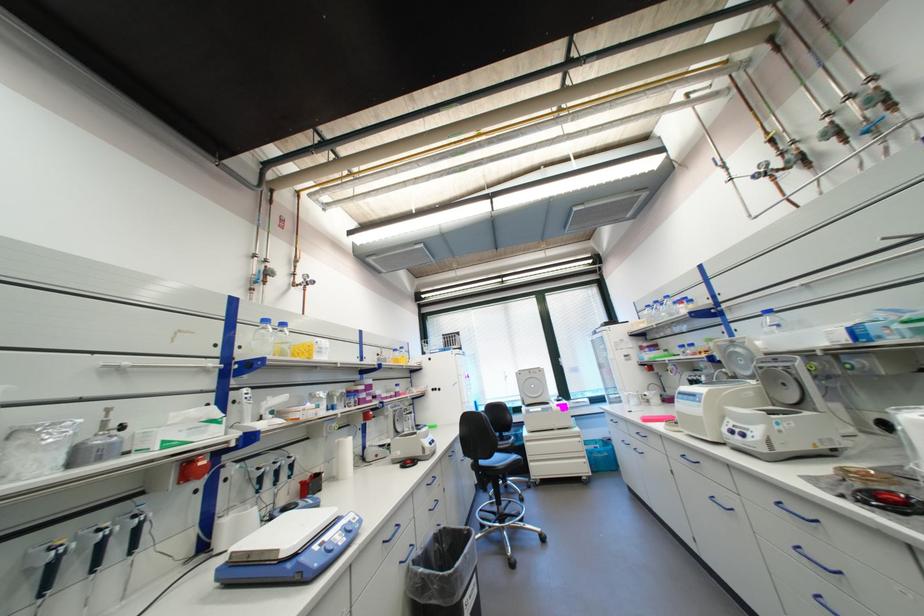
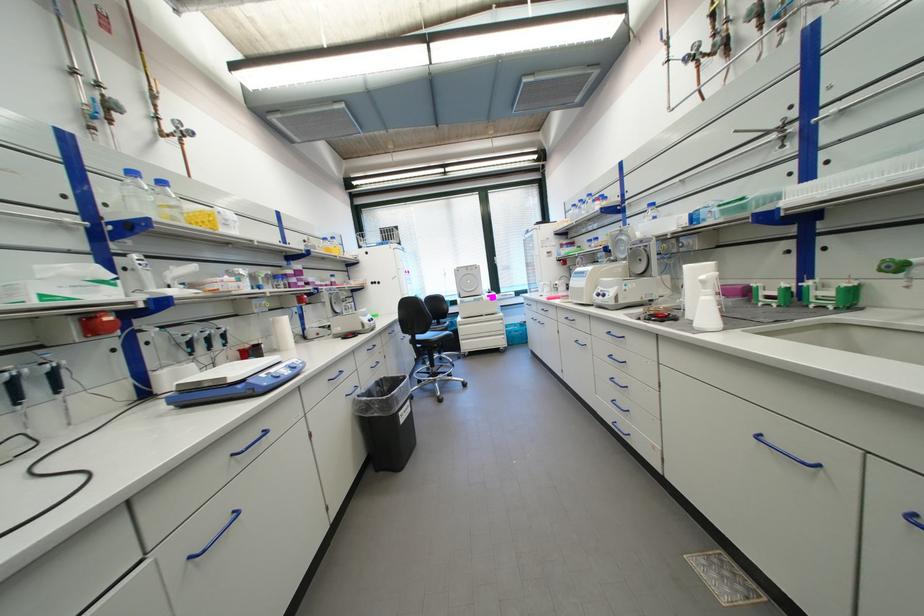
In the second image, find the point that corresponds to (x=339, y=458) in the first image.

(276, 334)